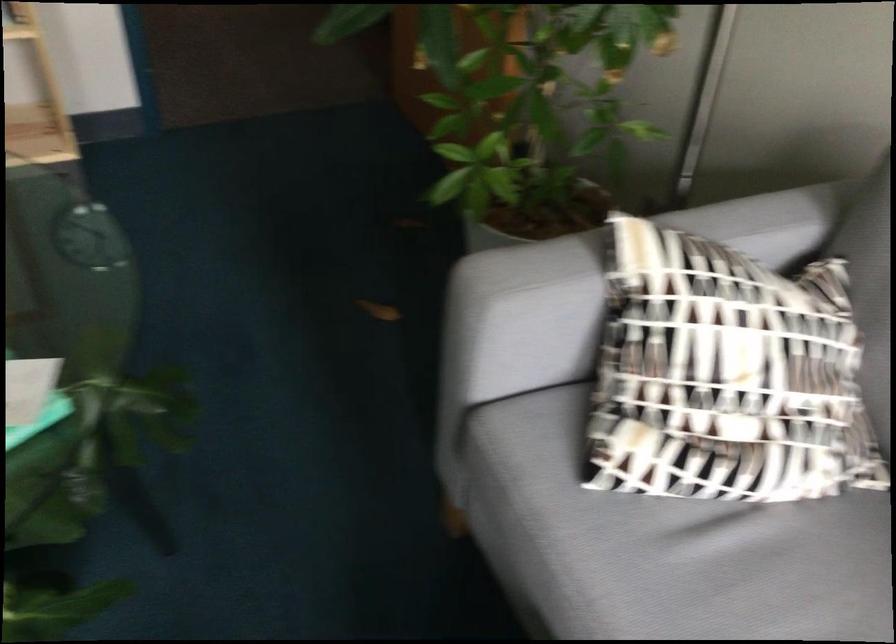
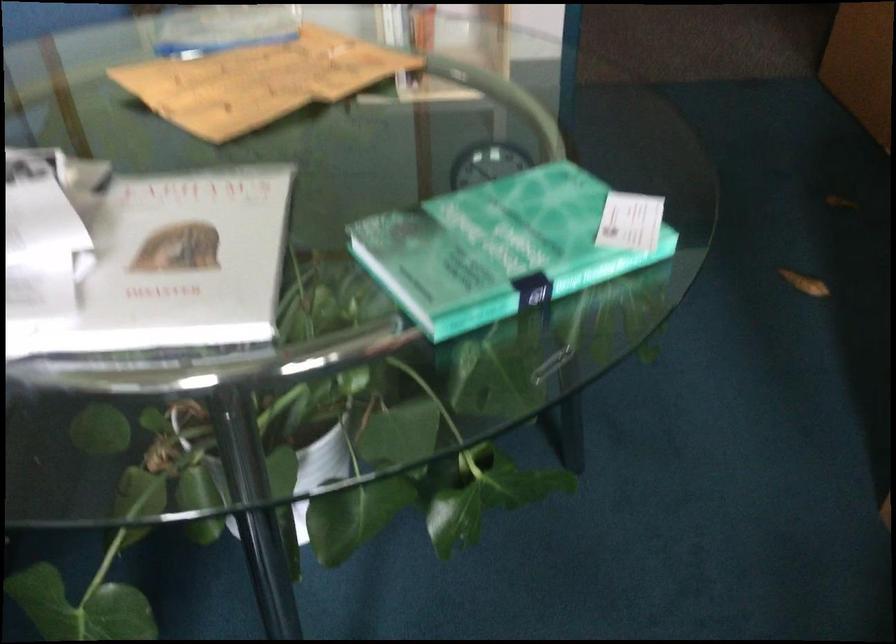
Question: The first image is from the beginning of the video and the second image is from the end. How did the camera likely rotate when shooting the video?

Choices:
 (A) Left
 (B) Right
 (C) Up
 (D) Down

Answer: (A)